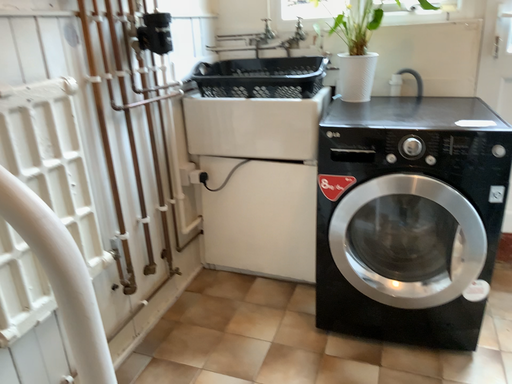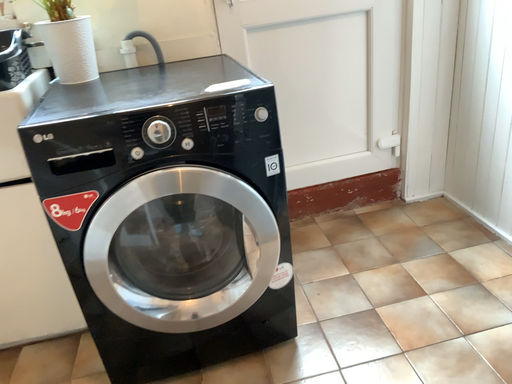
Question: How did the camera likely rotate when shooting the video?

Choices:
 (A) rotated left
 (B) rotated right

Answer: (B)